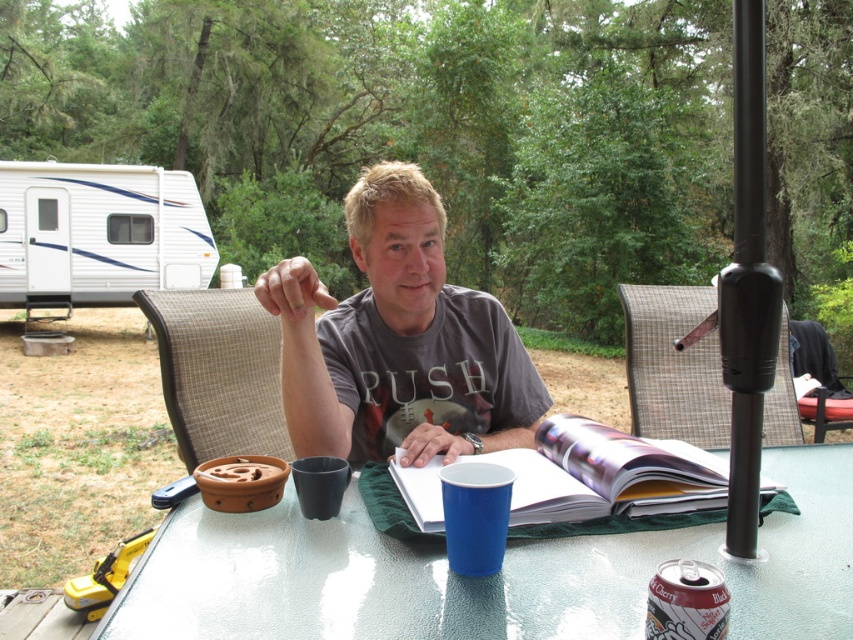
Which is below, transparent glass table at center or blue plastic cup at lower center?

transparent glass table at center is below.

Measure the distance between transparent glass table at center and camera.

transparent glass table at center and camera are 27.54 inches apart.

Find the location of `transparent glass table at center`. transparent glass table at center is located at coordinates (480, 579).

Between point (485, 365) and point (666, 440), which one is positioned behind?

The point (485, 365) is more distant.

Between gray cotton shirt at center and matte paper book at center, which one has more height?

gray cotton shirt at center is taller.

Between point (312, 332) and point (780, 484), which one is positioned in front?

Positioned in front is point (780, 484).

Where is `gray cotton shirt at center`? gray cotton shirt at center is located at coordinates (398, 340).

Can you confirm if gray cotton shirt at center is bigger than blue plastic cup at lower center?

Indeed, gray cotton shirt at center has a larger size compared to blue plastic cup at lower center.

This screenshot has width=853, height=640. Identify the location of gray cotton shirt at center. (398, 340).